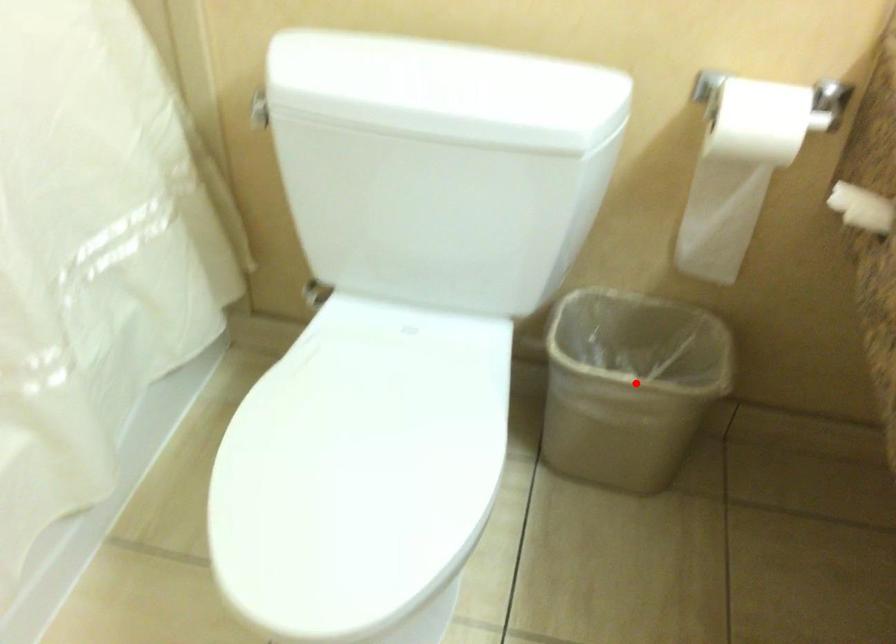
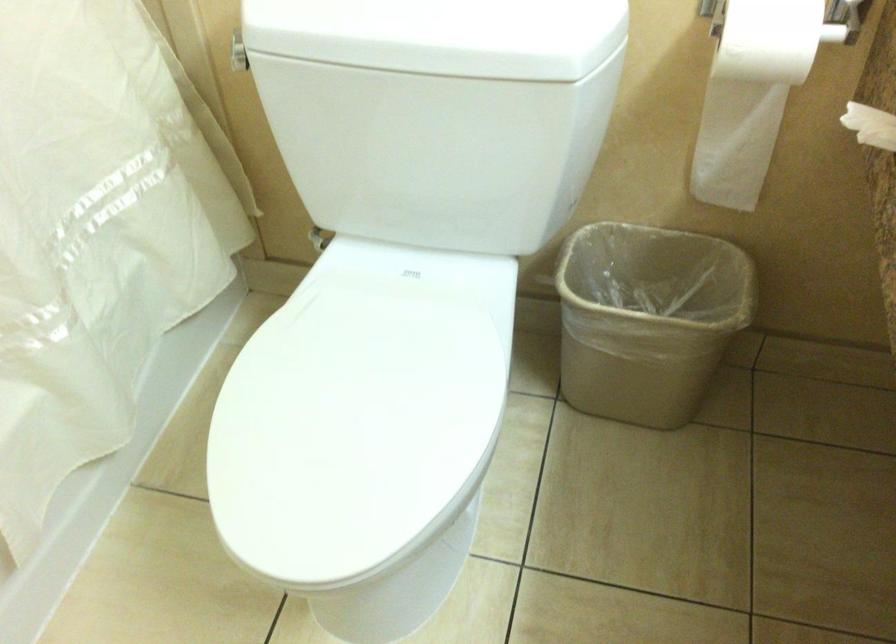
In the second image, find the point that corresponds to the highlighted location in the first image.

(647, 319)